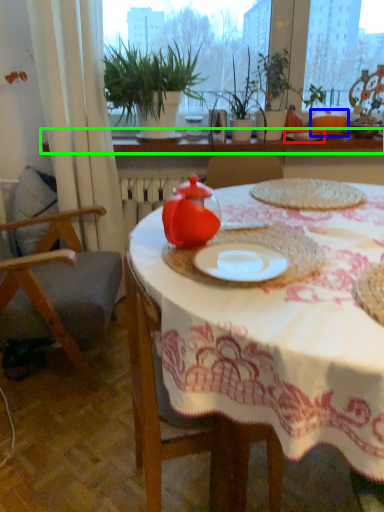
Question: Considering the real-world distances, which object is closest to tableware (highlighted by a red box)? pumpkin (highlighted by a blue box) or window sill (highlighted by a green box).

Choices:
 (A) pumpkin
 (B) window sill

Answer: (A)